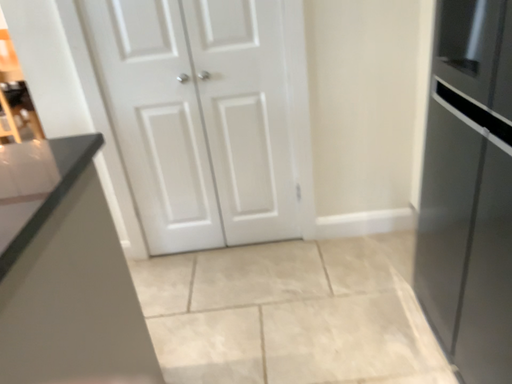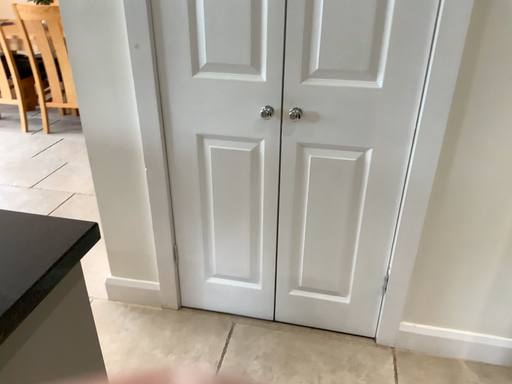
Question: How did the camera likely rotate when shooting the video?

Choices:
 (A) rotated left
 (B) rotated right

Answer: (A)